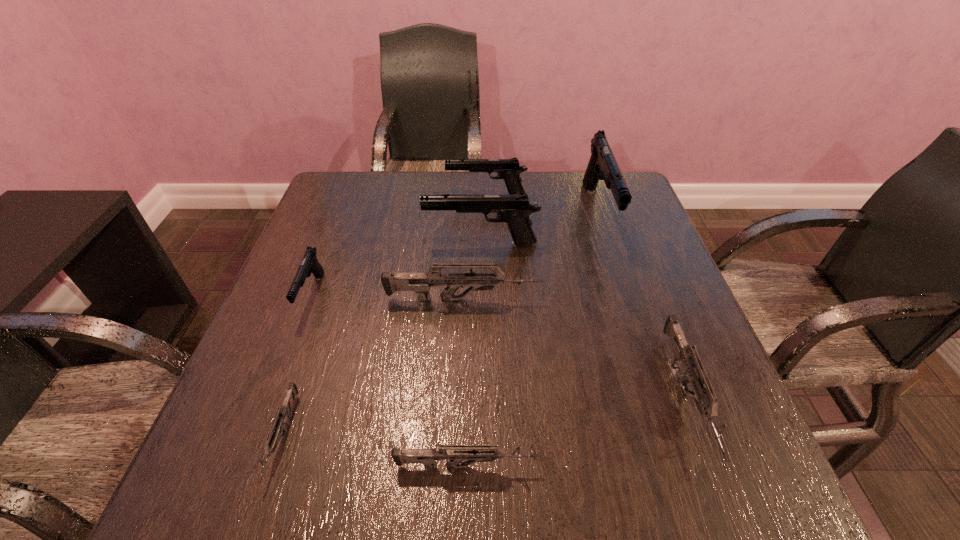
Identify the location of the second shortest object. The height and width of the screenshot is (540, 960). (455, 454).

Locate an element on the screen. the seventh tallest gun is located at coordinates (455, 454).

At what (x,y) coordinates should I click in order to perform the action: click on the shortest object. Please return your answer as a coordinate pair (x, y). The image size is (960, 540). Looking at the image, I should click on (273, 438).

I want to click on the shortest gun, so click(x=273, y=438).

In order to click on vacant region located 0.250m at the aiming end of the tallest gun in this screenshot , I will do `click(638, 336)`.

Image resolution: width=960 pixels, height=540 pixels. Find the location of `blank area located at the aiming end of the second biggest black gun`. blank area located at the aiming end of the second biggest black gun is located at coordinates (347, 244).

I want to click on vacant space located 0.130m at the aiming end of the second biggest black gun, so click(372, 244).

Identify the location of free region located 0.190m at the aiming end of the second biggest black gun. (347, 244).

Identify the location of free space located 0.110m at the aiming end of the second smallest black gun. (407, 195).

At what (x,y) coordinates should I click in order to perform the action: click on free space located 0.320m at the aiming end of the second smallest black gun. Please return your answer as a coordinate pair (x, y). Looking at the image, I should click on (330, 195).